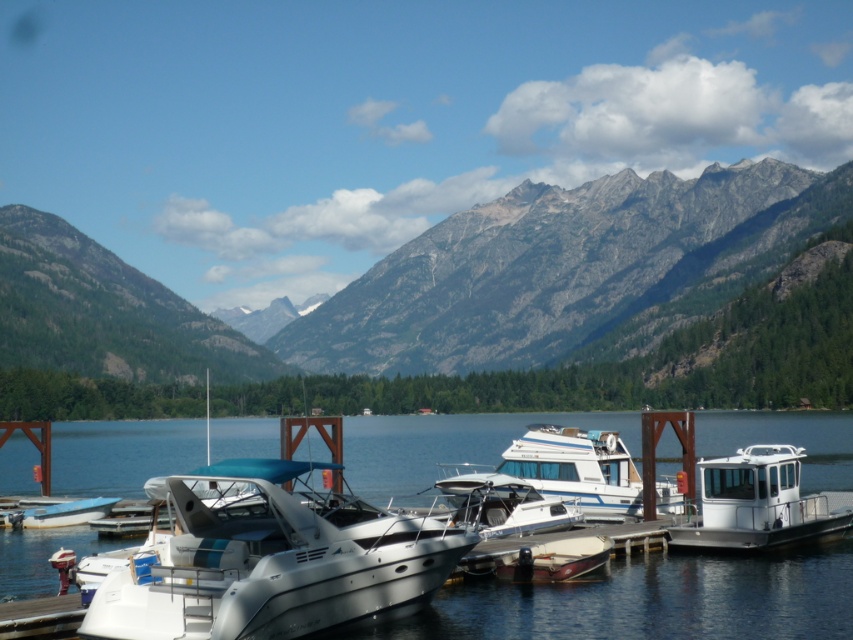
Consider the image. Is white glossy water at center smaller than white glossy boat at lower left?

No, white glossy water at center is not smaller than white glossy boat at lower left.

Which is more to the right, white glossy water at center or white glossy boat at lower left?

From the viewer's perspective, white glossy water at center appears more on the right side.

At what (x,y) coordinates should I click in order to perform the action: click on white glossy water at center. Please return your answer as a coordinate pair (x, y). Looking at the image, I should click on (659, 602).

Between white glossy houseboat at center and shiny brown boat at center, which one is positioned lower?

shiny brown boat at center

Which is in front, point (593, 432) or point (538, 564)?

Point (538, 564)

This screenshot has height=640, width=853. What do you see at coordinates (577, 468) in the screenshot? I see `white glossy houseboat at center` at bounding box center [577, 468].

Locate an element on the screen. white glossy houseboat at center is located at coordinates (577, 468).

Can you confirm if gray rocky mountain at left is smaller than shiny brown boat at center?

Actually, gray rocky mountain at left might be larger than shiny brown boat at center.

The width and height of the screenshot is (853, 640). I want to click on gray rocky mountain at left, so click(486, 307).

At what (x,y) coordinates should I click in order to perform the action: click on gray rocky mountain at left. Please return your answer as a coordinate pair (x, y). Looking at the image, I should click on (486, 307).